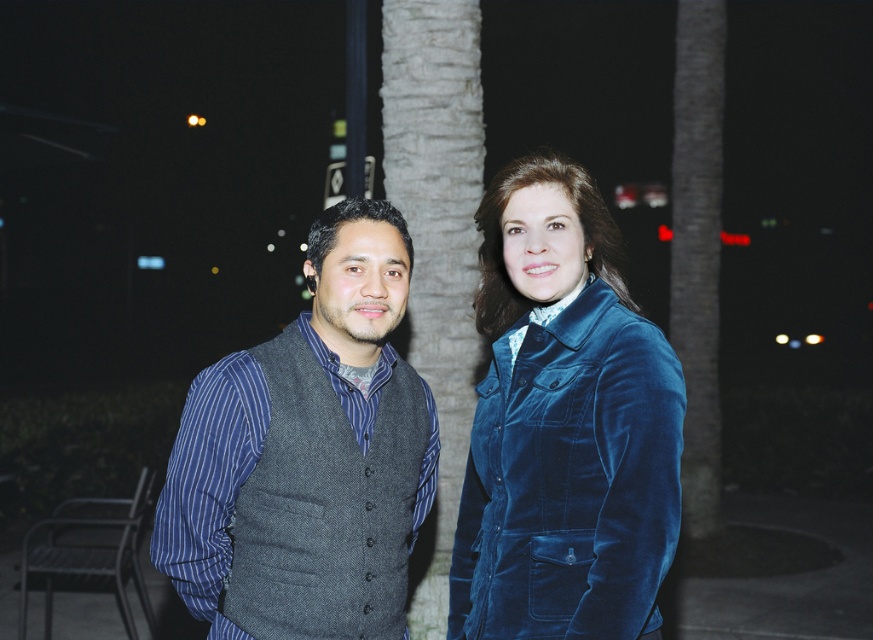
Which of these two, velvet blue jacket at right or gray wool vest at left, stands shorter?

gray wool vest at left is shorter.

Can you confirm if velvet blue jacket at right is positioned above gray wool vest at left?

Incorrect, velvet blue jacket at right is not positioned above gray wool vest at left.

Between point (476, 296) and point (425, 496), which one is positioned behind?

Positioned behind is point (425, 496).

You are a GUI agent. You are given a task and a screenshot of the screen. Output one action in this format:
    pyautogui.click(x=<x>, y=<y>)
    Task: Click on the velvet blue jacket at right
    
    Given the screenshot: What is the action you would take?
    pyautogui.click(x=562, y=426)

Does velvet blue jacket at center appear under gray wool vest at left?

Yes.

The width and height of the screenshot is (873, 640). Identify the location of velvet blue jacket at center. (307, 456).

Measure the distance between point (259, 346) and camera.

The distance of point (259, 346) from camera is 7.58 feet.

Locate an element on the screen. The image size is (873, 640). velvet blue jacket at center is located at coordinates (307, 456).

Does velvet blue jacket at center appear over velvet blue jacket at right?

Yes, velvet blue jacket at center is above velvet blue jacket at right.

Between velvet blue jacket at center and velvet blue jacket at right, which one is positioned higher?

velvet blue jacket at center is higher up.

What do you see at coordinates (307, 456) in the screenshot? I see `velvet blue jacket at center` at bounding box center [307, 456].

At what (x,y) coordinates should I click in order to perform the action: click on velvet blue jacket at center. Please return your answer as a coordinate pair (x, y). The height and width of the screenshot is (640, 873). Looking at the image, I should click on (307, 456).